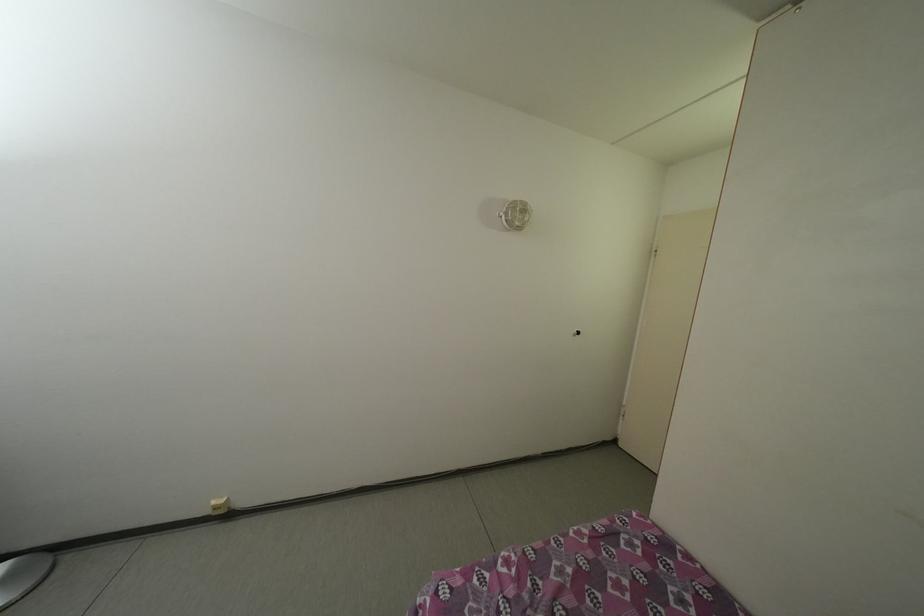
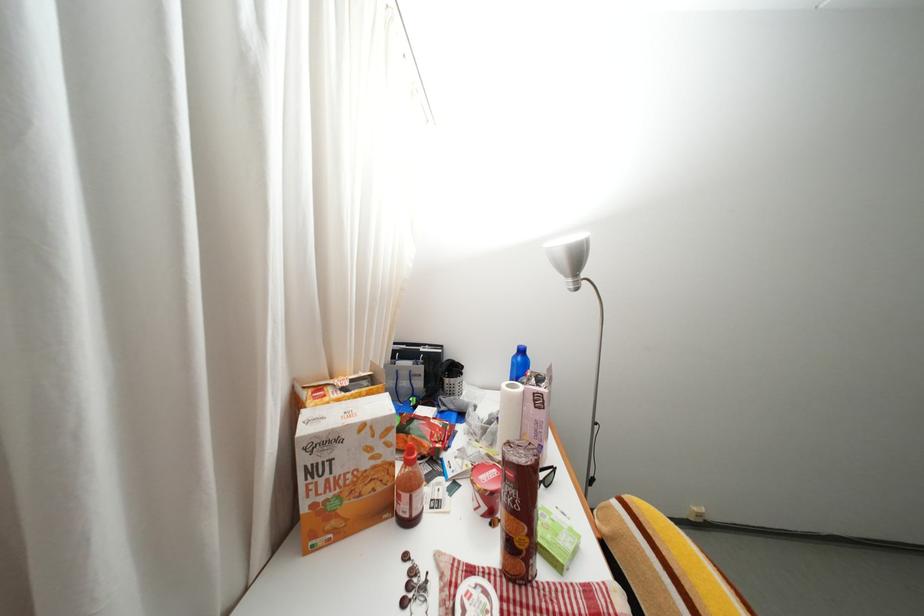
Question: The images are taken continuously from a first-person perspective. In which direction are you moving?

Choices:
 (A) Left
 (B) Right
 (C) Forward
 (D) Backward

Answer: (A)